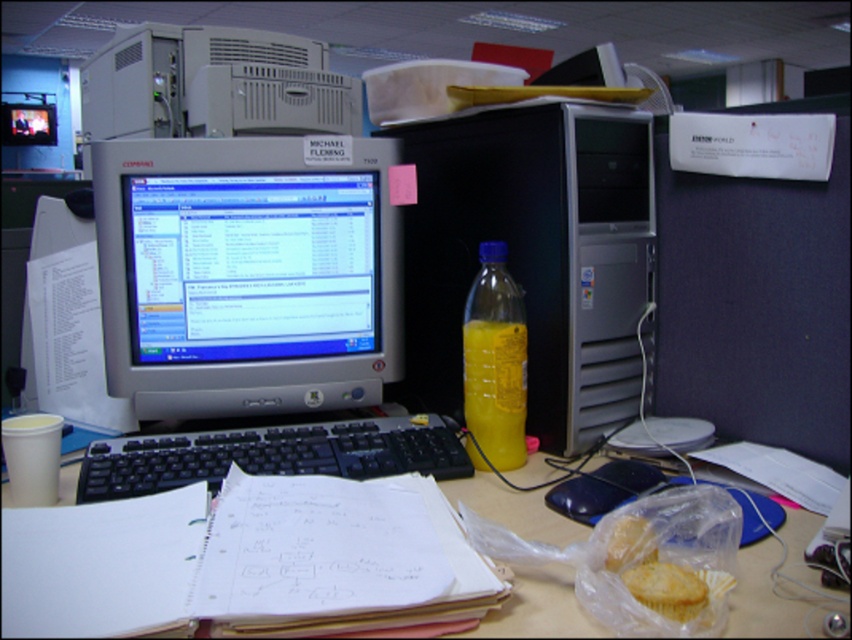
Between silver plastic monitor at center and black plastic keyboard at center, which one appears on the left side from the viewer's perspective?

silver plastic monitor at center is more to the left.

Who is more distant from viewer, (199,339) or (395,451)?

The point (199,339) is more distant.

The width and height of the screenshot is (852, 640). I want to click on silver plastic monitor at center, so click(x=246, y=273).

Can you confirm if satin silver computer tower at center is shorter than yellow translucent bottle at center?

Incorrect, satin silver computer tower at center's height does not fall short of yellow translucent bottle at center's.

This screenshot has width=852, height=640. What are the coordinates of `satin silver computer tower at center` in the screenshot? It's located at click(534, 256).

This screenshot has width=852, height=640. In order to click on satin silver computer tower at center in this screenshot , I will do pos(534,256).

Find the location of `satin silver computer tower at center`. satin silver computer tower at center is located at coordinates (534, 256).

Is silver plastic monitor at center positioned before yellow cake at lower right?

No, it is not.

Who is taller, silver plastic monitor at center or yellow cake at lower right?

With more height is silver plastic monitor at center.

Is point (390, 280) closer to viewer compared to point (668, 582)?

No, it is behind (668, 582).

This screenshot has height=640, width=852. In order to click on silver plastic monitor at center in this screenshot , I will do `click(246, 273)`.